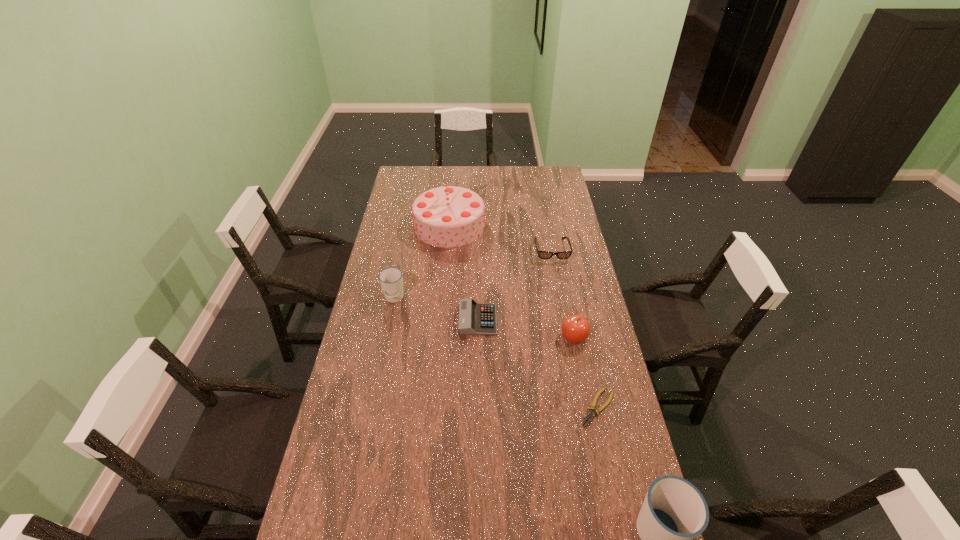
At what (x,y) coordinates should I click in order to perform the action: click on free spot that satisfies the following two spatial constraints: 1. on the lenses of the apple; 2. on the left side of the spectacles. Please return your answer as a coordinate pair (x, y). Looking at the image, I should click on (567, 338).

Identify the location of free space in the image that satisfies the following two spatial constraints: 1. on the lenses of the spectacles; 2. on the right side of the shortest object. (581, 408).

Find the location of `blank space that satisfies the following two spatial constraints: 1. on the front side of the tallest object; 2. on the right side of the calculator`. blank space that satisfies the following two spatial constraints: 1. on the front side of the tallest object; 2. on the right side of the calculator is located at coordinates (442, 320).